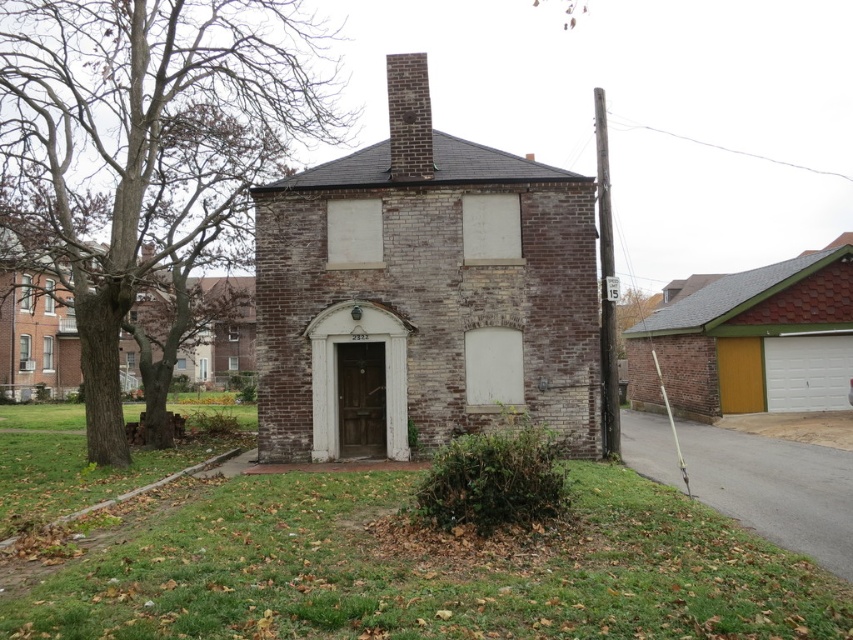
Question: Which object is farther from the camera taking this photo?

Choices:
 (A) wooden door at center
 (B) yellow wood garage at right

Answer: (B)

Question: Is yellow wood garage at right smaller than wooden door at center?

Choices:
 (A) no
 (B) yes

Answer: (A)

Question: Is yellow wood garage at right positioned behind wooden door at center?

Choices:
 (A) yes
 (B) no

Answer: (A)

Question: Which point is farther from the camera taking this photo?

Choices:
 (A) (828, 305)
 (B) (335, 420)

Answer: (A)

Question: Can you confirm if yellow wood garage at right is smaller than wooden door at center?

Choices:
 (A) no
 (B) yes

Answer: (A)